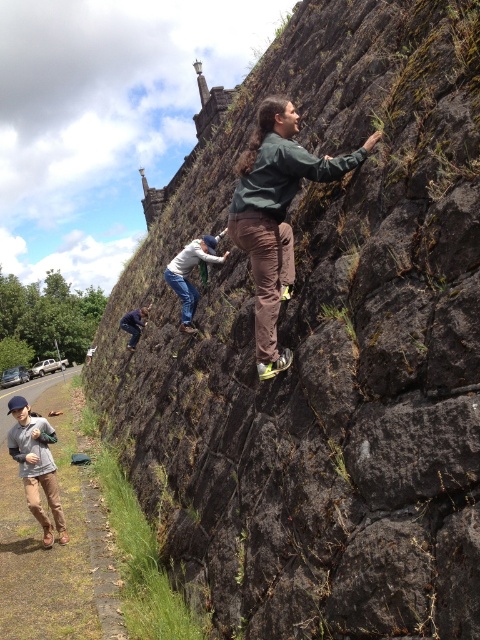
Question: Can you confirm if green fabric jacket at center is positioned to the left of khaki cotton pants at lower left?

Choices:
 (A) yes
 (B) no

Answer: (B)

Question: Which of the following is the farthest from the observer?

Choices:
 (A) (265, 204)
 (B) (56, 499)

Answer: (B)

Question: Does green fabric jacket at center appear over khaki cotton pants at lower left?

Choices:
 (A) no
 (B) yes

Answer: (B)

Question: Among these points, which one is nearest to the camera?

Choices:
 (A) (233, 236)
 (B) (48, 493)

Answer: (A)

Question: Which point is closer to the camera taking this photo?

Choices:
 (A) (x=55, y=433)
 (B) (x=254, y=180)

Answer: (B)

Question: Does green fabric jacket at center have a greater width compared to khaki cotton pants at lower left?

Choices:
 (A) yes
 (B) no

Answer: (A)